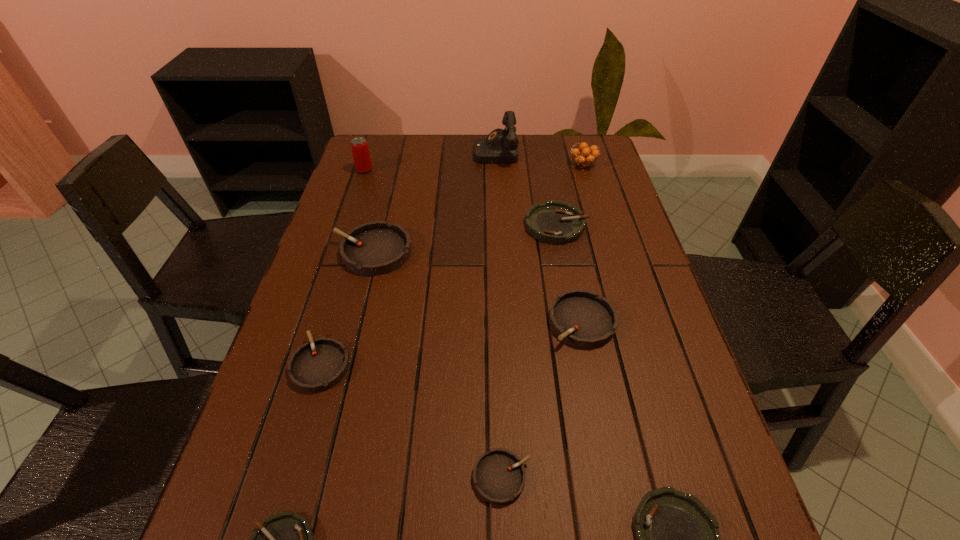
Identify the location of free region that satisfies the following two spatial constraints: 1. on the dial of the tallest object; 2. on the back side of the biggest green ashtray. This screenshot has height=540, width=960. [x=499, y=225].

Locate an element on the screen. Image resolution: width=960 pixels, height=540 pixels. vacant space that satisfies the following two spatial constraints: 1. on the dial of the telephone; 2. on the right side of the second biggest gray ashtray is located at coordinates (504, 322).

Find the location of a particular element. free space that satisfies the following two spatial constraints: 1. on the back side of the third biggest gray ashtray; 2. on the left side of the farthest green ashtray is located at coordinates (362, 225).